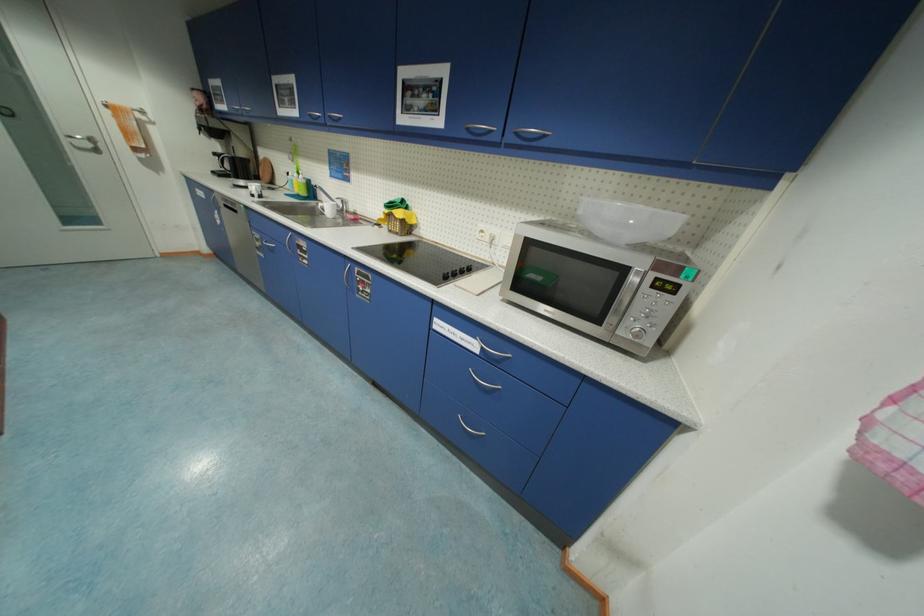
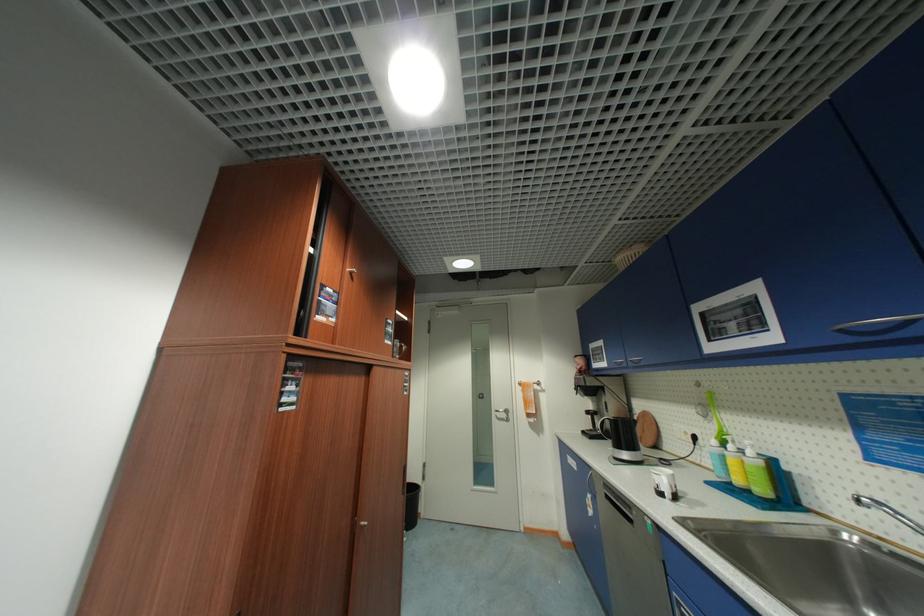
In the second image, find the point that corresponds to (259,197) in the first image.

(666, 495)